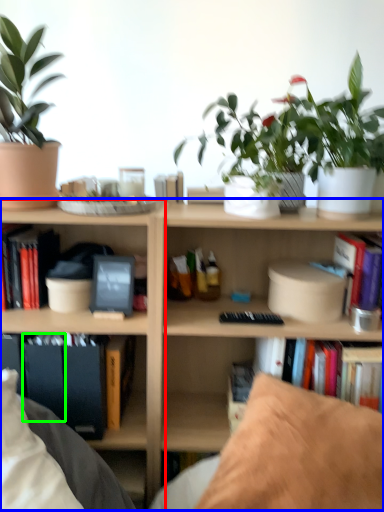
Question: Which is farther away from shelf (highlighted by a red box)? bookcase (highlighted by a blue box) or paperback book (highlighted by a green box)?

Choices:
 (A) bookcase
 (B) paperback book

Answer: (B)